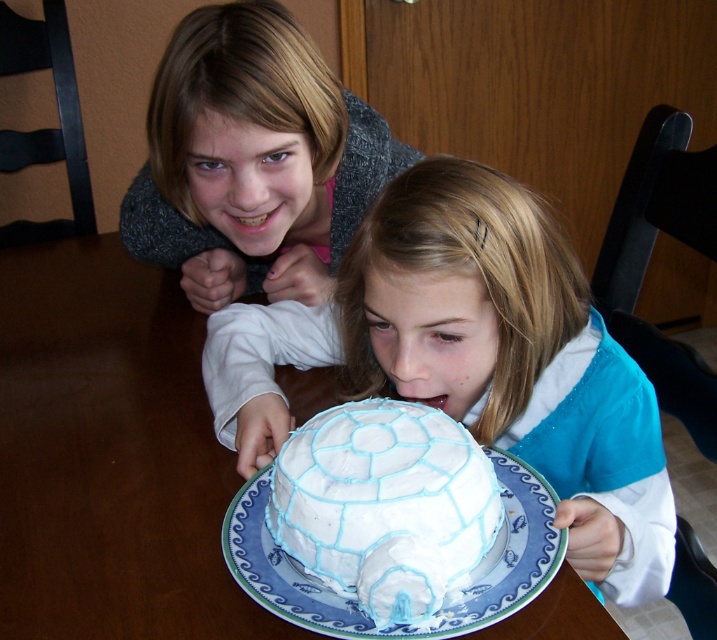
You are a photographer trying to capture a closeup of the white frosting igloo at center. However, the matte gray sweater at upper left is blocking your view. Can you move the sweater to the right to get a clear shot?

The matte gray sweater at upper left is to the left of the white frosting igloo at center, so moving it to the right would allow you to get a clear shot of the white frosting igloo at center.

You are a photographer standing at the edge of the table where the white glossy cake at center is placed. You want to take a closeup shot of the cake without moving any objects. Considering your current position, can you get a clear closeup shot of the cake?

The white glossy cake at center is 23.13 inches from viewer. Since photographers typically need to be within 12 to 18 inches for a closeup shot, you would need to move closer to achieve the desired focus and clarity.